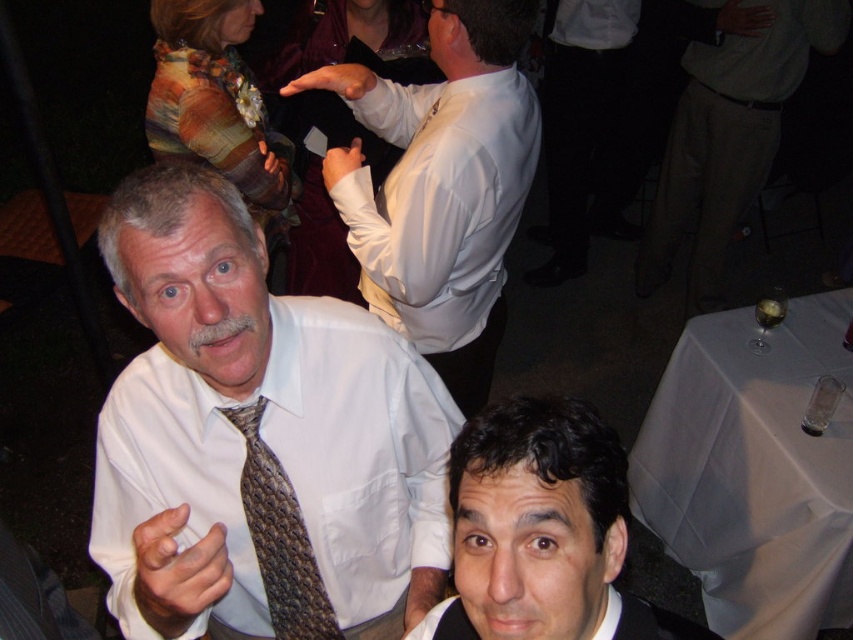
You are a photographer at this event and want to capture a photo that includes both the white textured shirt at center and the smooth black hair at lower right. The camera has a focus range of 35 centimeters. Will you be able to fit both subjects within the focus range?

The white textured shirt at center is 36.34 centimeters from smooth black hair at lower right. Since the distance between them exceeds the camera focus range of 35 centimeters, the camera cannot focus on both subjects simultaneously.

You are a photographer at the event and want to ensure both the white textured shirt at center and the smooth black hair at lower right are clearly visible in your photo. Which object should you focus on to ensure clarity, considering their sizes?

A: The white textured shirt at center is bigger than the smooth black hair at lower right, so focusing on the larger object, the white textured shirt at center, will ensure both are in focus as it requires less precision due to its size.